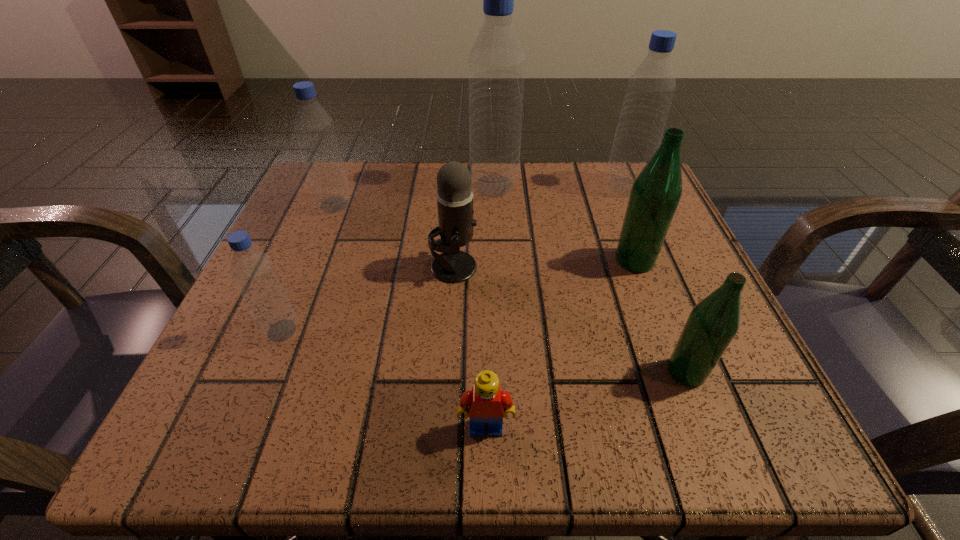
Identify the location of the tallest object. The height and width of the screenshot is (540, 960). (496, 63).

This screenshot has width=960, height=540. I want to click on the fourth bottle from right to left, so click(x=496, y=63).

This screenshot has height=540, width=960. Identify the location of the fifth shortest bottle. (649, 93).

I want to click on the third smallest blue bottle, so click(x=649, y=93).

Find the location of `the second smallest blue bottle`. the second smallest blue bottle is located at coordinates (314, 128).

Locate an element on the screen. the farther green bottle is located at coordinates (656, 192).

In order to click on the bigger green bottle in this screenshot , I will do `click(656, 192)`.

Image resolution: width=960 pixels, height=540 pixels. Find the location of `gray microphone`. gray microphone is located at coordinates (454, 195).

The height and width of the screenshot is (540, 960). Identify the location of the third nearest object. (253, 271).

The image size is (960, 540). Identify the location of the nearest blue bottle. (253, 271).